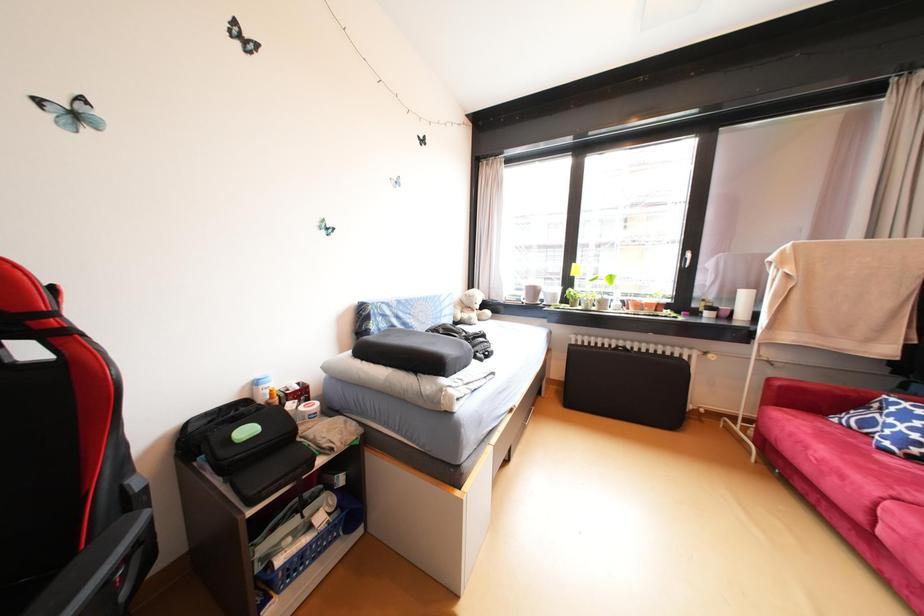
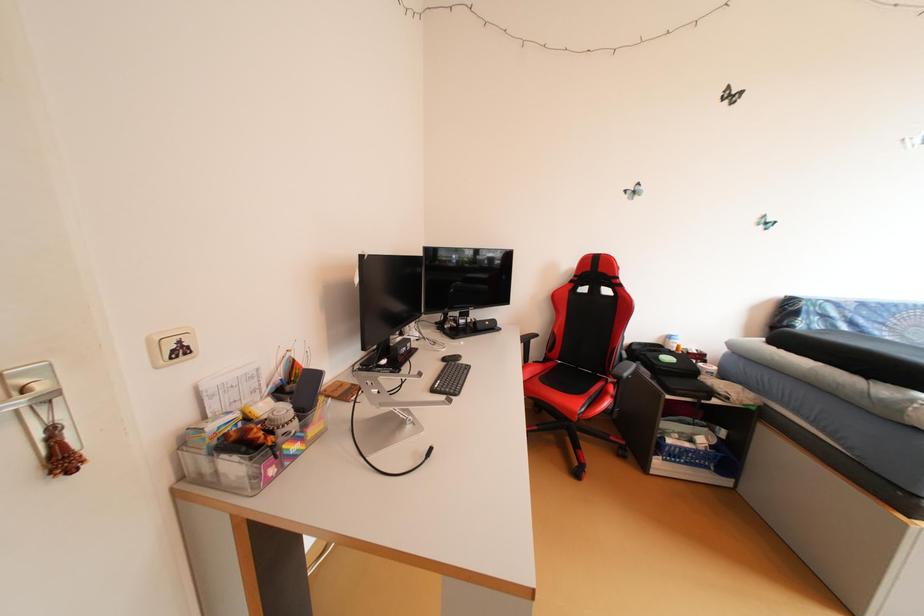
Question: The first image is from the beginning of the video and the second image is from the end. How did the camera likely rotate when shooting the video?

Choices:
 (A) Left
 (B) Right
 (C) Up
 (D) Down

Answer: (A)